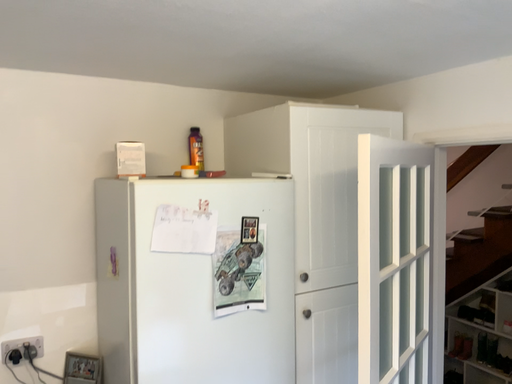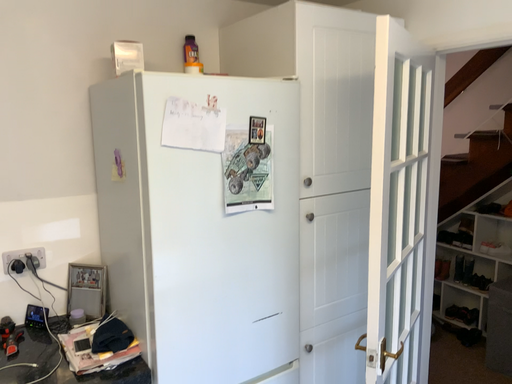
Question: Which way did the camera rotate in the video?

Choices:
 (A) rotated upward
 (B) rotated downward

Answer: (B)